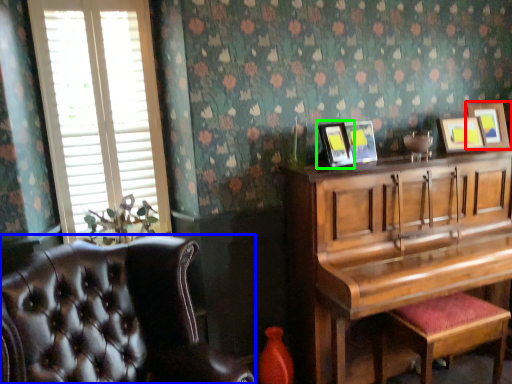
Question: Considering the real-world distances, which object is farthest from picture frame (highlighted by a red box)? chair (highlighted by a blue box) or picture frame (highlighted by a green box)?

Choices:
 (A) chair
 (B) picture frame

Answer: (A)